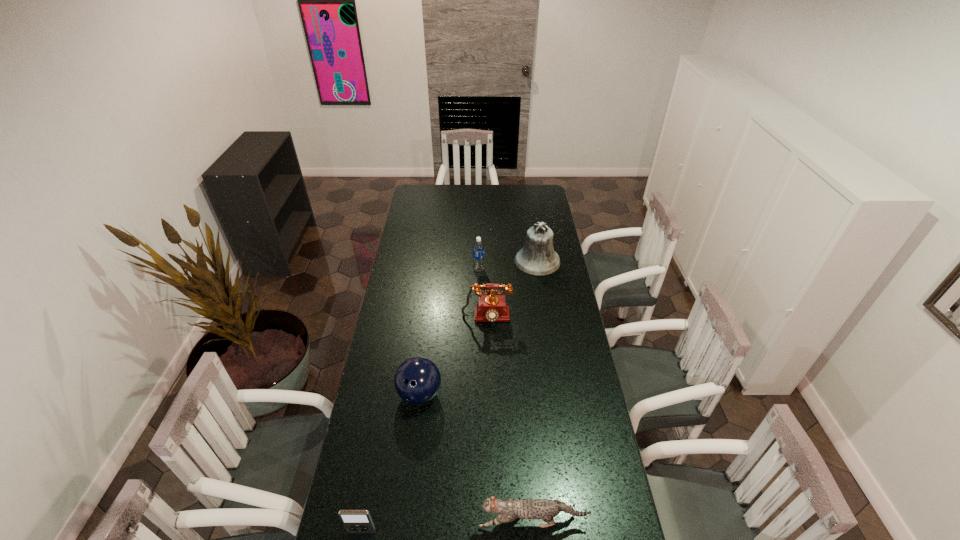
Locate an element on the screen. empty space between the fourth nearest object and the cat is located at coordinates (510, 420).

You are a GUI agent. You are given a task and a screenshot of the screen. Output one action in this format:
    pyautogui.click(x=<x>, y=<y>)
    Task: Click on the free spot between the telephone and the iPod
    The width and height of the screenshot is (960, 540).
    Given the screenshot: What is the action you would take?
    pyautogui.click(x=424, y=425)

Image resolution: width=960 pixels, height=540 pixels. Find the location of `vacant area that lies between the water bottle and the third nearest object`. vacant area that lies between the water bottle and the third nearest object is located at coordinates (449, 332).

At what (x,y) coordinates should I click in order to perform the action: click on vacant space in between the third farthest object and the iPod. Please return your answer as a coordinate pair (x, y). Image resolution: width=960 pixels, height=540 pixels. Looking at the image, I should click on (424, 425).

Locate an element on the screen. This screenshot has width=960, height=540. free space between the bell and the iPod is located at coordinates (449, 396).

Where is `free space between the cat and the tallest object`? This screenshot has width=960, height=540. free space between the cat and the tallest object is located at coordinates (535, 392).

Image resolution: width=960 pixels, height=540 pixels. I want to click on blank region between the third nearest object and the water bottle, so click(449, 332).

You are a GUI agent. You are given a task and a screenshot of the screen. Output one action in this format:
    pyautogui.click(x=<x>, y=<y>)
    Task: Click on the empty space that is in between the water bottle and the bowling ball
    Image resolution: width=960 pixels, height=540 pixels.
    Given the screenshot: What is the action you would take?
    pyautogui.click(x=449, y=332)

At what (x,y) coordinates should I click in order to perform the action: click on object that is the nearest to the bell. Please return your answer as a coordinate pair (x, y). Image resolution: width=960 pixels, height=540 pixels. Looking at the image, I should click on (478, 247).

I want to click on object that is the fifth nearest to the bell, so click(355, 521).